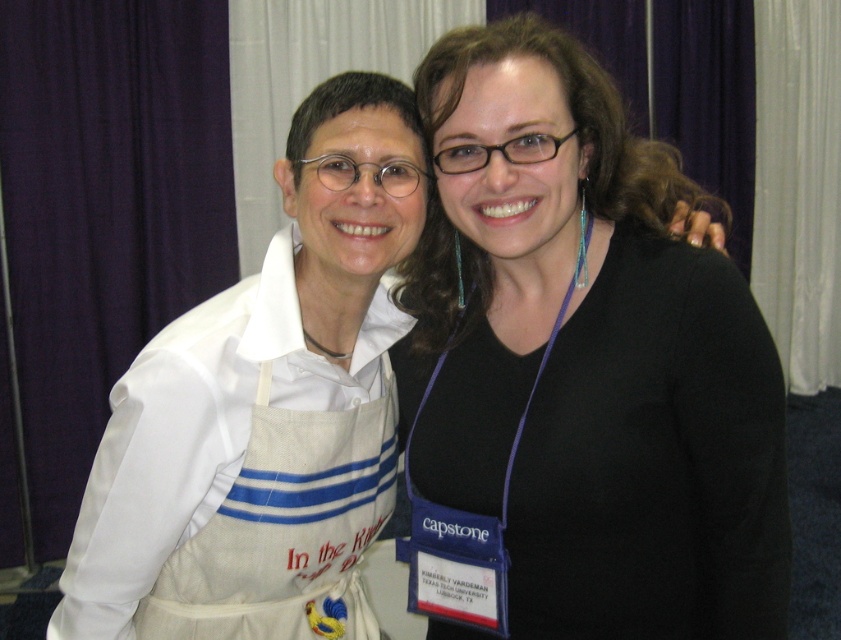
Does white fabric apron at left appear under whitecanvasapron at left?

No.

What do you see at coordinates (257, 378) in the screenshot? I see `white fabric apron at left` at bounding box center [257, 378].

In order to click on white fabric apron at left in this screenshot , I will do `click(257, 378)`.

What do you see at coordinates (586, 356) in the screenshot?
I see `black matte shirt at center` at bounding box center [586, 356].

Does black matte shirt at center come in front of whitecanvasapron at left?

Yes, it is in front of whitecanvasapron at left.

Find the location of `black matte shirt at center`. black matte shirt at center is located at coordinates (586, 356).

Can you confirm if black matte shirt at center is shorter than white fabric apron at left?

No.

Who is positioned more to the right, black matte shirt at center or white fabric apron at left?

Positioned to the right is black matte shirt at center.

At what (x,y) coordinates should I click in order to perform the action: click on black matte shirt at center. Please return your answer as a coordinate pair (x, y). Looking at the image, I should click on (586, 356).

Where is `black matte shirt at center`? black matte shirt at center is located at coordinates (586, 356).